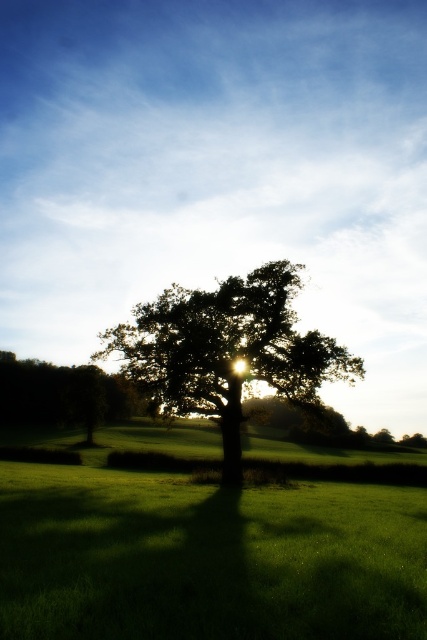
Question: Is dark green leafy oak tree at center wider than green leafy tree at left?

Choices:
 (A) yes
 (B) no

Answer: (B)

Question: From the image, what is the correct spatial relationship of green grass at center in relation to dark green leafy oak tree at center?

Choices:
 (A) above
 (B) below

Answer: (B)

Question: Which object is the farthest from the dark green leafy oak tree at center?

Choices:
 (A) green leafy tree at left
 (B) green grass at center

Answer: (A)

Question: Is green grass at center behind green leafy tree at left?

Choices:
 (A) yes
 (B) no

Answer: (B)

Question: Based on their relative distances, which object is nearer to the dark green leafy oak tree at center?

Choices:
 (A) green leafy tree at left
 (B) green grass at center

Answer: (B)

Question: Estimate the real-world distances between objects in this image. Which object is farther from the green leafy tree at left?

Choices:
 (A) green grass at center
 (B) dark green leafy oak tree at center

Answer: (A)